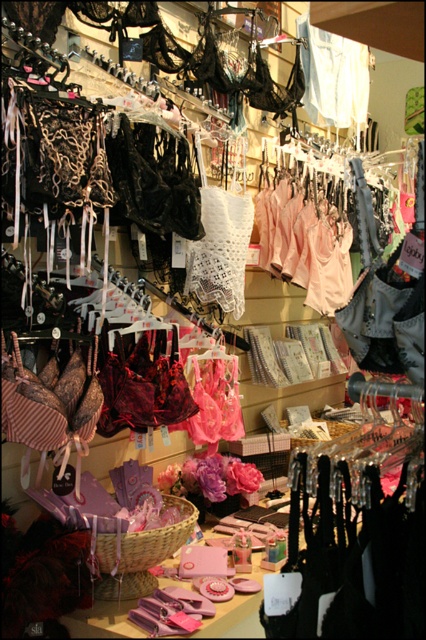
Question: Which point appears farthest from the camera in this image?

Choices:
 (A) (189, 515)
 (B) (322, 42)

Answer: (B)

Question: Which object appears farthest from the camera in this image?

Choices:
 (A) light beige lace lingerie at center
 (B) brown woven basket at center

Answer: (A)

Question: Is the position of light beige lace lingerie at center more distant than that of brown woven basket at center?

Choices:
 (A) yes
 (B) no

Answer: (A)

Question: Can you confirm if light beige lace lingerie at center is positioned to the right of brown woven basket at center?

Choices:
 (A) yes
 (B) no

Answer: (A)

Question: Does light beige lace lingerie at center come in front of brown woven basket at center?

Choices:
 (A) no
 (B) yes

Answer: (A)